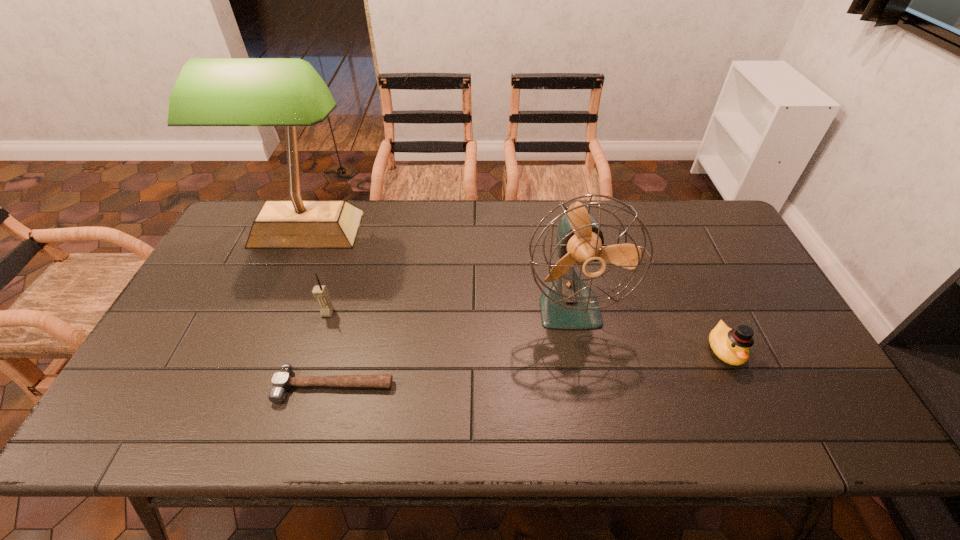
Identify the location of free location located 0.270m on the front of the cellular telephone, where the keypad is located. (298, 409).

Locate an element on the screen. The height and width of the screenshot is (540, 960). vacant space located on the front-facing side of the fourth tallest object is located at coordinates (749, 402).

Where is `object positioned at the far edge`? object positioned at the far edge is located at coordinates (288, 92).

You are a GUI agent. You are given a task and a screenshot of the screen. Output one action in this format:
    pyautogui.click(x=<x>, y=<y>)
    Task: Click on the object that is at the left edge
    The image size is (960, 540).
    Given the screenshot: What is the action you would take?
    pyautogui.click(x=288, y=92)

The width and height of the screenshot is (960, 540). I want to click on object present at the right edge, so tap(732, 346).

I want to click on object present at the far left corner, so click(288, 92).

Locate an element on the screen. blank space at the far edge is located at coordinates (555, 212).

In the image, there is a desktop. Where is `vacant space at the near edge`? This screenshot has height=540, width=960. vacant space at the near edge is located at coordinates pyautogui.click(x=471, y=409).

Identify the location of vacant space at the left edge. click(226, 267).

The height and width of the screenshot is (540, 960). I want to click on free point at the right edge, so click(777, 403).